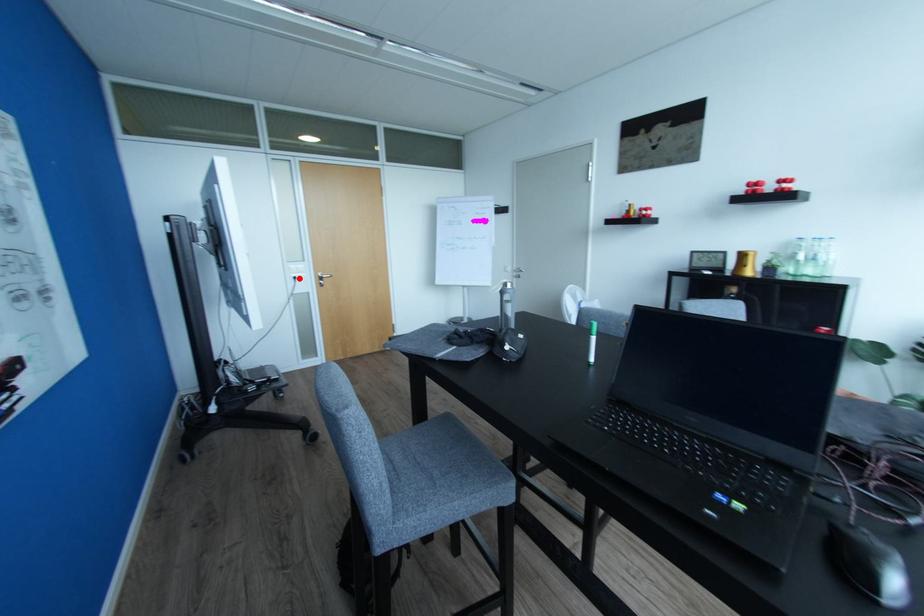
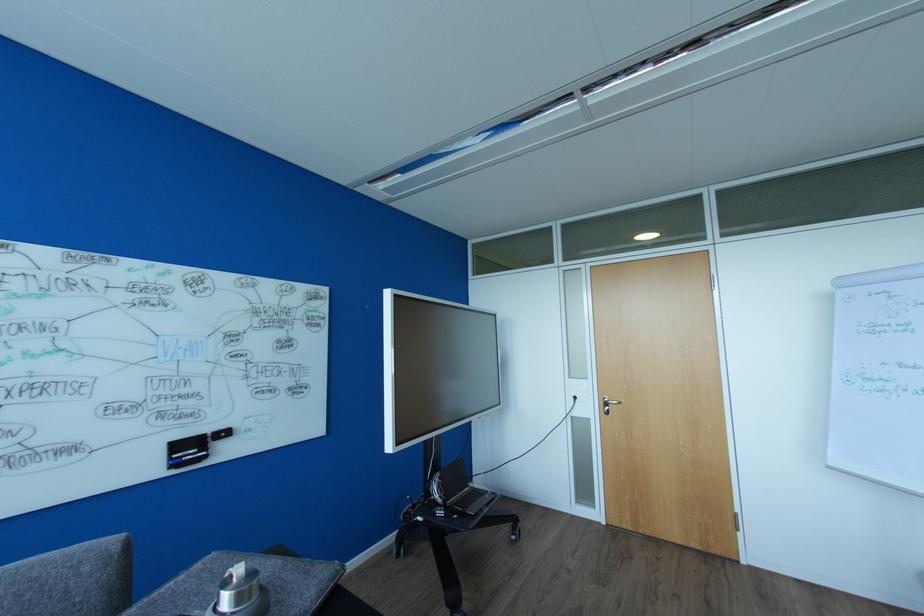
Question: I am providing you with two images of the same scene from different viewpoints. Given a red point in image1, look at the same physical point in image2. Is it:

Choices:
 (A) Closer to the viewpoint
 (B) Farther from the viewpoint

Answer: (B)